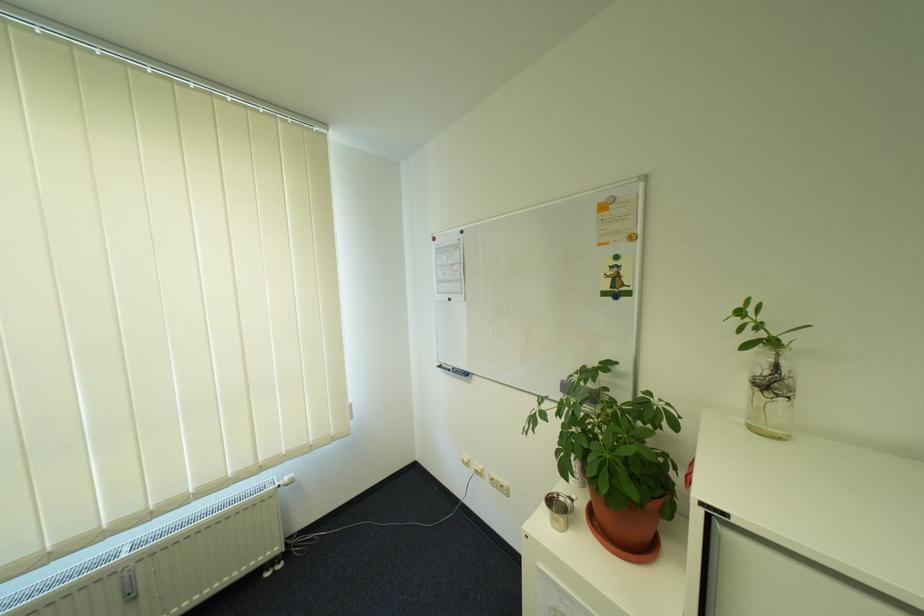
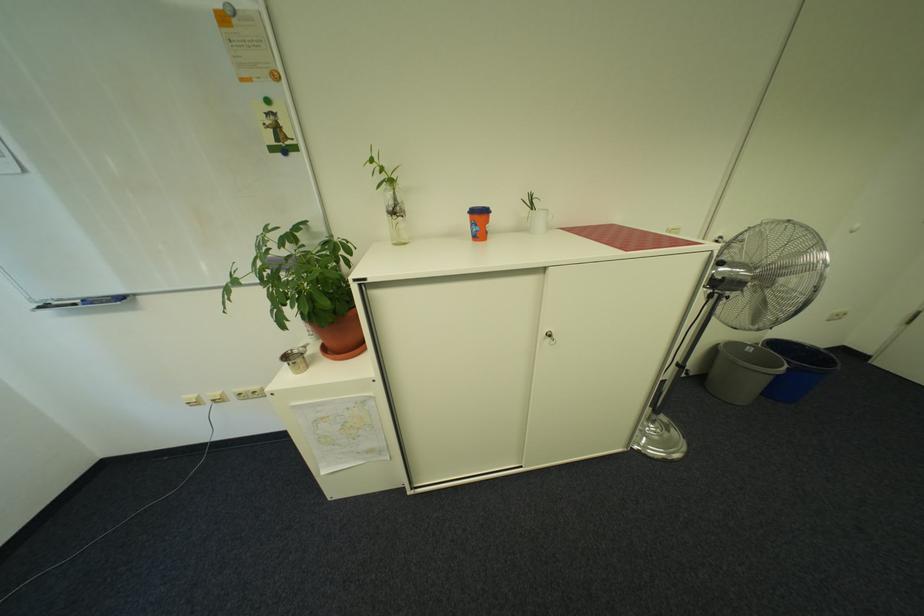
First-person continuous shooting, in which direction is the camera rotating?

The camera rotated toward right-down.